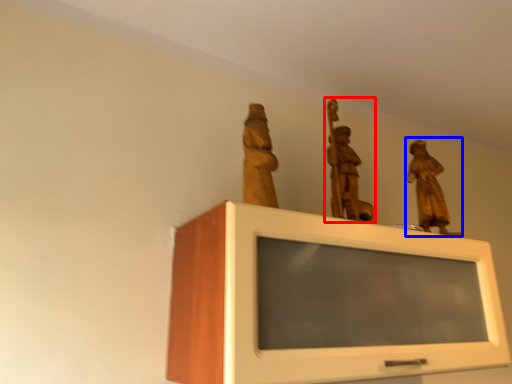
Question: Which object is further to the camera taking this photo, sculpture (highlighted by a red box) or sculpture (highlighted by a blue box)?

Choices:
 (A) sculpture
 (B) sculpture

Answer: (B)